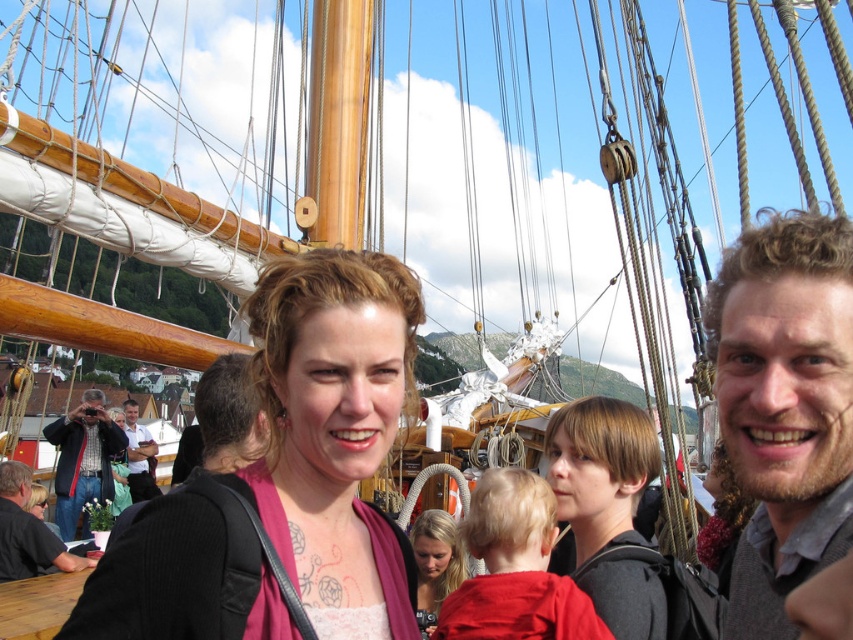
Which is in front, point (840, 387) or point (7, 532)?

Point (840, 387)

Can you confirm if curly hair man at right is wider than dark gray shirt at lower left?

No.

Measure the distance between point (834, 502) and camera.

A distance of 21.69 meters exists between point (834, 502) and camera.

I want to click on curly hair man at right, so click(784, 406).

Between brown hair at center and brushed metal camera at lower left, which one is positioned lower?

brushed metal camera at lower left is below.

Is brown hair at center above brushed metal camera at lower left?

Yes, brown hair at center is above brushed metal camera at lower left.

Between point (260, 451) and point (86, 532), which one is positioned in front?

Point (260, 451) is in front.

The image size is (853, 640). What are the coordinates of `brown hair at center` in the screenshot? It's located at (222, 420).

At what (x,y) coordinates should I click in order to perform the action: click on smooth brown hair at center. Please return your answer as a coordinate pair (x, y). Looking at the image, I should click on (598, 474).

Who is more distant from viewer, (587, 588) or (428, 516)?

Point (428, 516)

Locate an element on the screen. smooth brown hair at center is located at coordinates (598, 474).